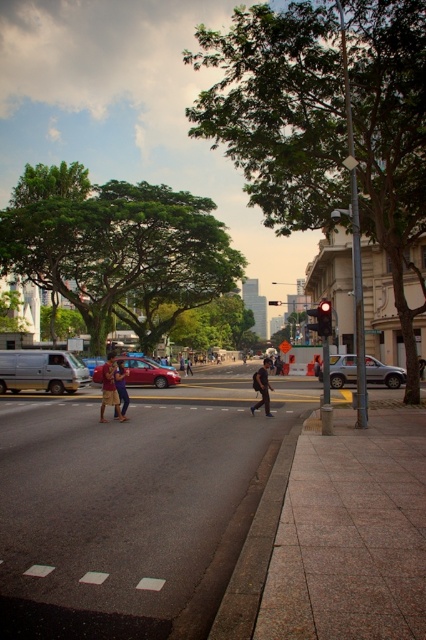
You are standing at the pedestrian crossing and want to cross the street to the lamppost on the right. There is a silver metallic van at left at point (40, 371). Should you be concerned about the van blocking your path?

The silver metallic van at left at point (40, 371) is located to the left of your path towards the lamppost on the right, so it should not block your way.

You are a delivery person with a 80 feet long package that needs to be placed between the dark brown backpack at center and the denim shorts at center. Can you fit the package between them without bending or cutting it?

The distance between the dark brown backpack at center and the denim shorts at center is 79.99 feet. Since the package is exactly 80 feet long, it will not fit between them without bending or cutting it because the space is slightly shorter than the package.

You are a pedestrian standing at the edge of the sidewalk. You see a dark brown backpack at center and denim shorts at center. Which object is closer to you?

The dark brown backpack at center is closer to you because it is in front of denim shorts at center.